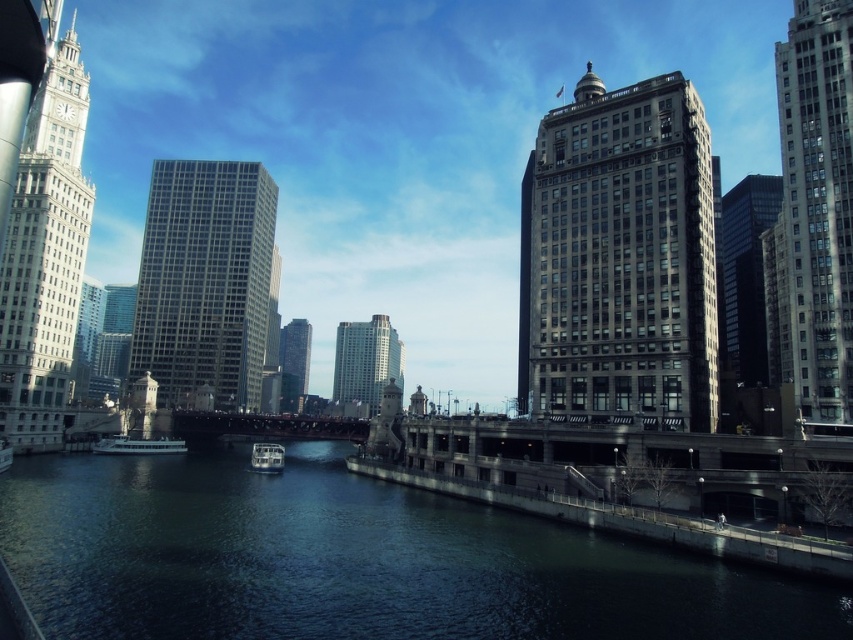
Question: Which object is positioned closest to the silver metallic skyscraper at center?

Choices:
 (A) white glass skyscraper at left
 (B) metallic bridge at center
 (C) gray stone skyscraper at right
 (D) smooth glass skyscraper at center

Answer: (D)

Question: Does dark water at center appear over metallic bridge at center?

Choices:
 (A) no
 (B) yes

Answer: (B)

Question: Does dark water at center have a smaller size compared to smooth glass skyscraper at center?

Choices:
 (A) no
 (B) yes

Answer: (B)

Question: Which object is farther from the camera taking this photo?

Choices:
 (A) silver metallic skyscraper at center
 (B) white glossy boat at center
 (C) dark water at center
 (D) gray stone skyscraper at right

Answer: (A)

Question: Observing the image, what is the correct spatial positioning of gray stone skyscraper at right in reference to smooth glass skyscraper at center?

Choices:
 (A) below
 (B) above

Answer: (B)

Question: Which point appears closest to the camera in this image?

Choices:
 (A) (233, 268)
 (B) (335, 422)

Answer: (B)